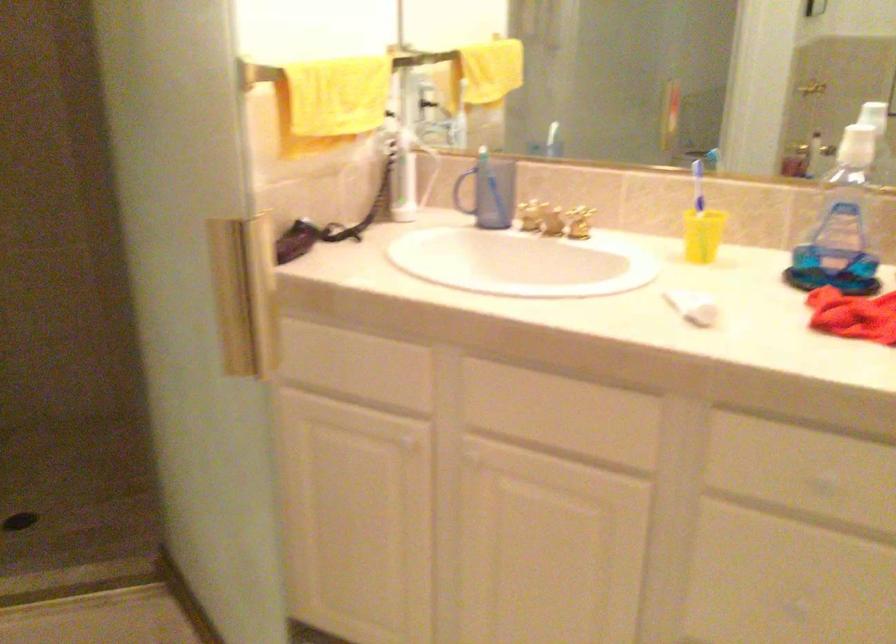
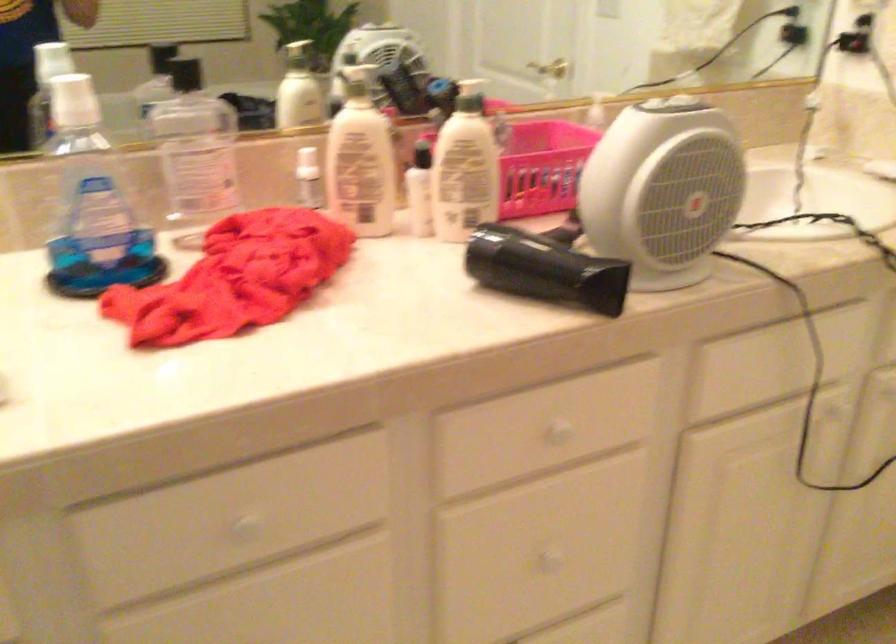
Question: The camera is either moving clockwise (left) or counter-clockwise (right) around the object. The first image is from the beginning of the video and the second image is from the end. Is the camera moving left or right when shooting the video?

Choices:
 (A) Left
 (B) Right

Answer: (A)